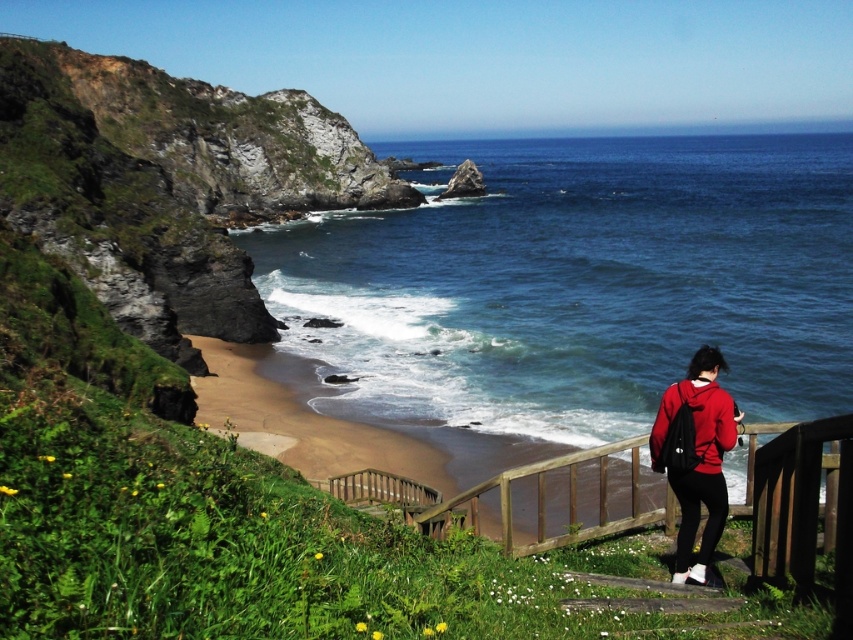
Consider the image. You are a photographer standing on the grassy slope with yellow flowers. You want to take a photo that includes both the blue water at center and the wooden at lower right. Which object should you zoom in on to make both fit in the frame?

You should zoom in on the wooden at lower right because the blue water at center is much taller than the wooden at lower right, so adjusting focus to the closer object will help both fit better in the frame.

You are standing on the grassy slope with yellow flowers and looking towards the ocean. There is a blue water at center and a matte red jacket at lower right. Which object is closer to you?

The matte red jacket at lower right is behind the blue water at center, so the blue water at center is closer to you.